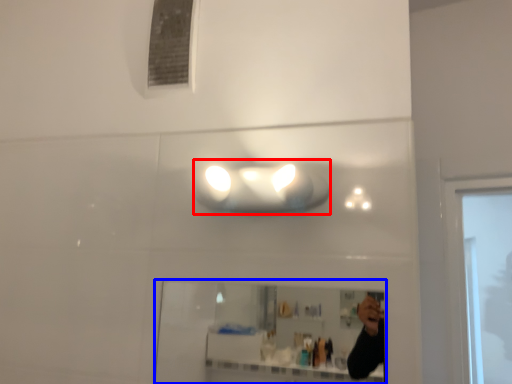
Question: Which of the following is the closest to the observer, light fixture (highlighted by a red box) or mirror (highlighted by a blue box)?

Choices:
 (A) light fixture
 (B) mirror

Answer: (B)